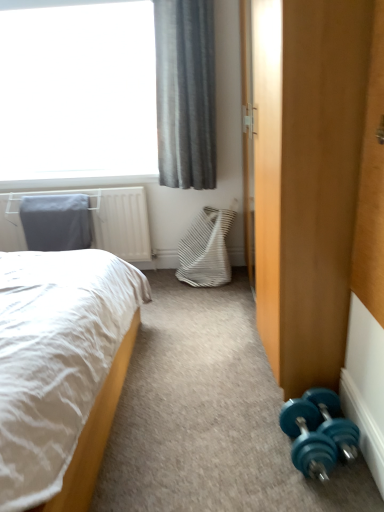
Where is `vacant area that is in front of teal rubber dumbbell at lower right, the second dumbbell positioned from the right`? This screenshot has height=512, width=384. vacant area that is in front of teal rubber dumbbell at lower right, the second dumbbell positioned from the right is located at coordinates (316, 495).